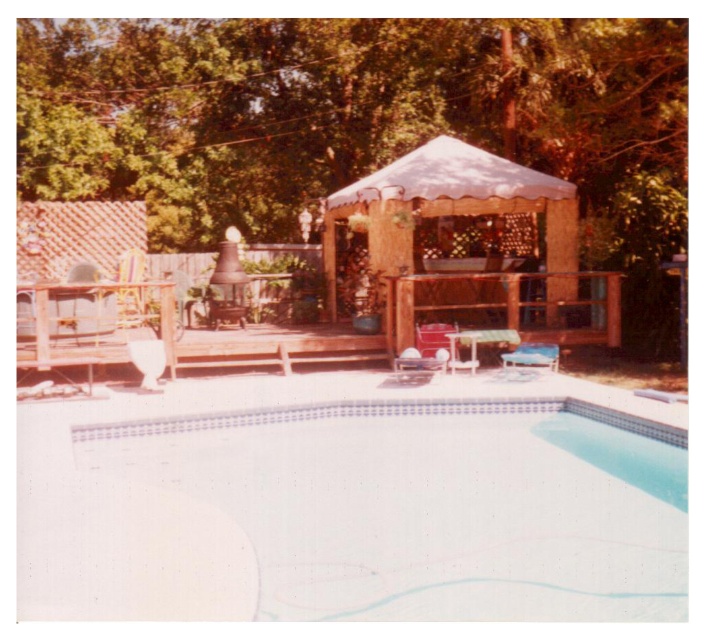
You are standing at the center of the pool and want to look towards the green leafy tree at upper center. In which direction should you turn your head?

The green leafy tree at upper center is located at coordinates 0.191 on the x axis and 0.514 on the y axis. Since the tree is at upper center, you should look upwards and slightly to the left from the pool center to face it.

You are planning to place a new bench in the backyard. The bench requires a space wider than the wooden gazebo at center. Based on the scene, is the white smooth pool at lower center a suitable location for placing the bench?

The white smooth pool at lower center is wider than the wooden gazebo at center, so it can provide the required space. However, placing a bench directly on the pool might not be feasible since pools are typically bodies of water. Consider the deck area around the pool instead.

Based on the photo, you are standing in the backyard looking at the swimming pool and the gazebo. There are two points marked in the image. The first point is at coordinates point (77, 33) and the second is at point (565, 180). Which point is closer to you?

Point (77, 33) is closer to you because it is further to the viewer than point (565, 180).